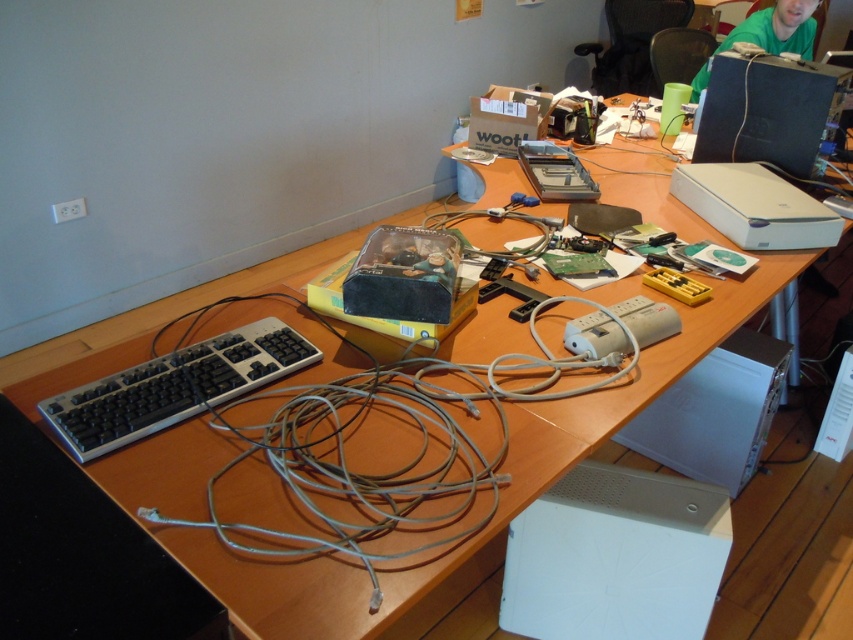
Question: Which point is closer to the camera?

Choices:
 (A) white plastic computer tower at lower right
 (B) black plastic desktop computer at upper right
 (C) black plastic keyboard at left
 (D) white plastic desktop computer at lower right

Answer: (C)

Question: Which of the following is the closest to the observer?

Choices:
 (A) (737, 394)
 (B) (662, 618)

Answer: (B)

Question: Can you confirm if black plastic keyboard at left is positioned to the right of white plastic computer tower at lower right?

Choices:
 (A) yes
 (B) no

Answer: (B)

Question: Does white plastic desktop computer at lower right have a larger size compared to black plastic desktop computer at upper right?

Choices:
 (A) yes
 (B) no

Answer: (A)

Question: Is white plastic desktop computer at lower right in front of white plastic computer tower at lower right?

Choices:
 (A) yes
 (B) no

Answer: (A)

Question: Which point is closer to the camera?

Choices:
 (A) black plastic keyboard at left
 (B) black plastic desktop computer at upper right

Answer: (A)